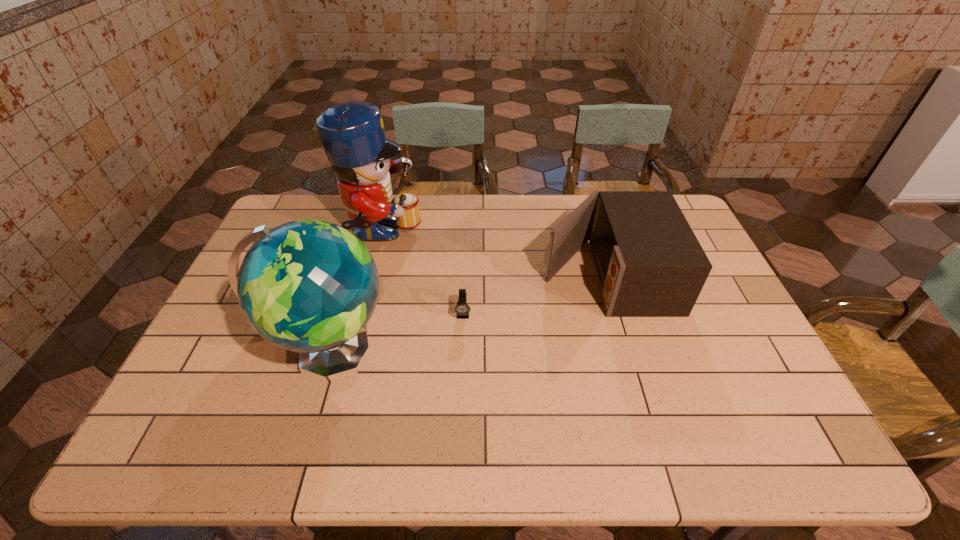
Identify the location of vacant region between the third tallest object and the third object from left to right. Image resolution: width=960 pixels, height=540 pixels. click(x=534, y=295).

Identify the location of unoccupied area between the rightmost object and the nutcracker. (493, 255).

Find the location of `the third closest object to the nutcracker`. the third closest object to the nutcracker is located at coordinates (650, 263).

Select which object is the third closest to the shortest object. Please provide its 2D coordinates. Your answer should be formatted as a tuple, i.e. [(x, y)], where the tuple contains the x and y coordinates of a point satisfying the conditions above.

[(352, 133)]

What are the coordinates of `blank space that satisfies the following two spatial constraints: 1. with the door open on the front of the rightmost object; 2. on the face of the shortest object` in the screenshot? It's located at 616,314.

The image size is (960, 540). In order to click on vacant area that satisfies the following two spatial constraints: 1. with the door open on the front of the rightmost object; 2. on the face of the shortest object in this screenshot , I will do `click(616, 314)`.

Identify the location of vacant space that satisfies the following two spatial constraints: 1. with the door open on the front of the rightmost object; 2. on the face of the third object from left to right. The width and height of the screenshot is (960, 540). (616, 314).

Where is `free space that satisfies the following two spatial constraints: 1. with the door open on the front of the microwave oven; 2. on the face of the shortest object`? The height and width of the screenshot is (540, 960). free space that satisfies the following two spatial constraints: 1. with the door open on the front of the microwave oven; 2. on the face of the shortest object is located at coordinates (616, 314).

You are a GUI agent. You are given a task and a screenshot of the screen. Output one action in this format:
    pyautogui.click(x=<x>, y=<y>)
    Task: Click on the free space that satisfies the following two spatial constraints: 1. with the door open on the front of the rightmost object; 2. on the face of the second object from right to left
    The width and height of the screenshot is (960, 540).
    Given the screenshot: What is the action you would take?
    pyautogui.click(x=616, y=314)